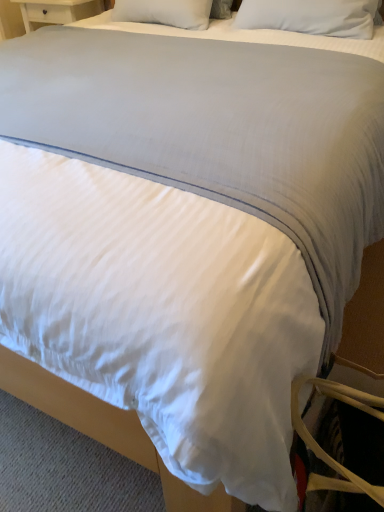
Question: Based on their sizes in the image, would you say tan leather swivel chair at lower right is bigger or smaller than white soft pillow at upper center, which ranks as the 1th pillow in right-to-left order?

Choices:
 (A) big
 (B) small

Answer: (B)

Question: From their relative heights in the image, would you say tan leather swivel chair at lower right is taller or shorter than white soft pillow at upper center, the second pillow viewed from the left?

Choices:
 (A) tall
 (B) short

Answer: (A)

Question: Which is farther from the tan leather swivel chair at lower right?

Choices:
 (A) white soft pillow at upper center, the second pillow positioned from the right
 (B) white soft pillow at upper center, which ranks as the 1th pillow in right-to-left order

Answer: (A)

Question: Which of these objects is positioned closest to the white soft pillow at upper center, the second pillow viewed from the left?

Choices:
 (A) tan leather swivel chair at lower right
 (B) white soft pillow at upper center, placed as the first pillow when sorted from left to right

Answer: (B)